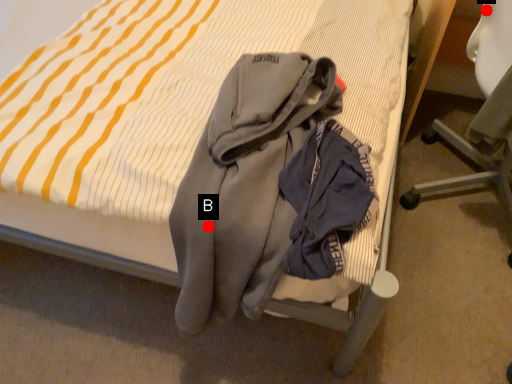
Question: Two points are circled on the image, labeled by A and B beside each circle. Which point is further to the camera?

Choices:
 (A) A is further
 (B) B is further

Answer: (A)